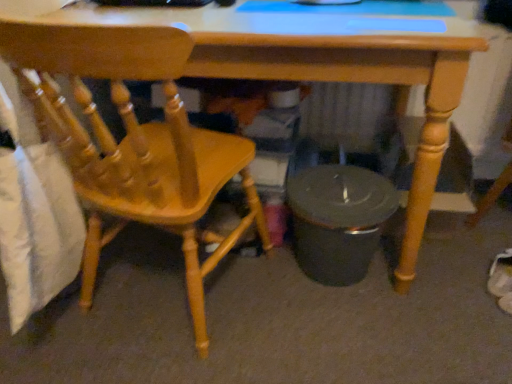
Image resolution: width=512 pixels, height=384 pixels. Find the location of `vacant region under matte wood chair at left (from a real-world perspective)`. vacant region under matte wood chair at left (from a real-world perspective) is located at coordinates (162, 306).